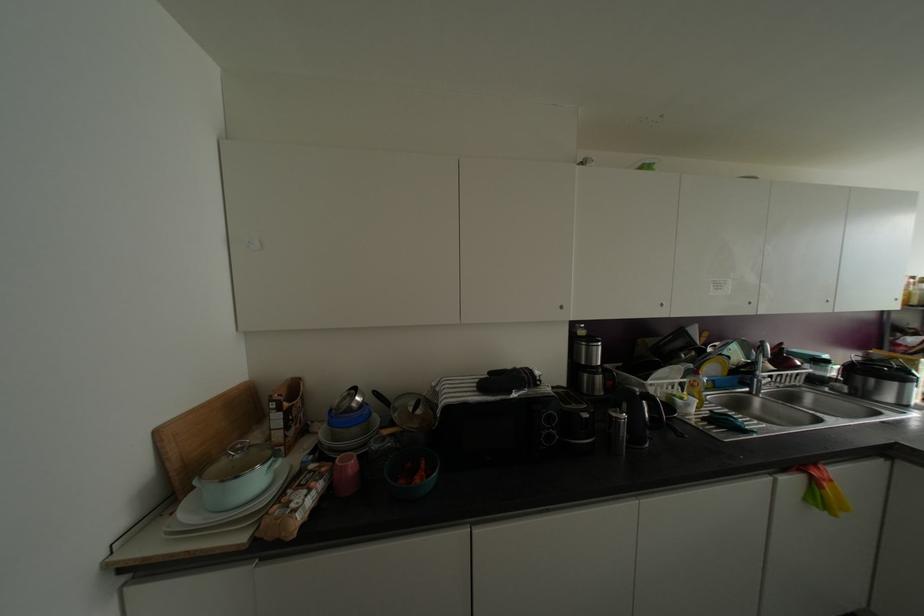
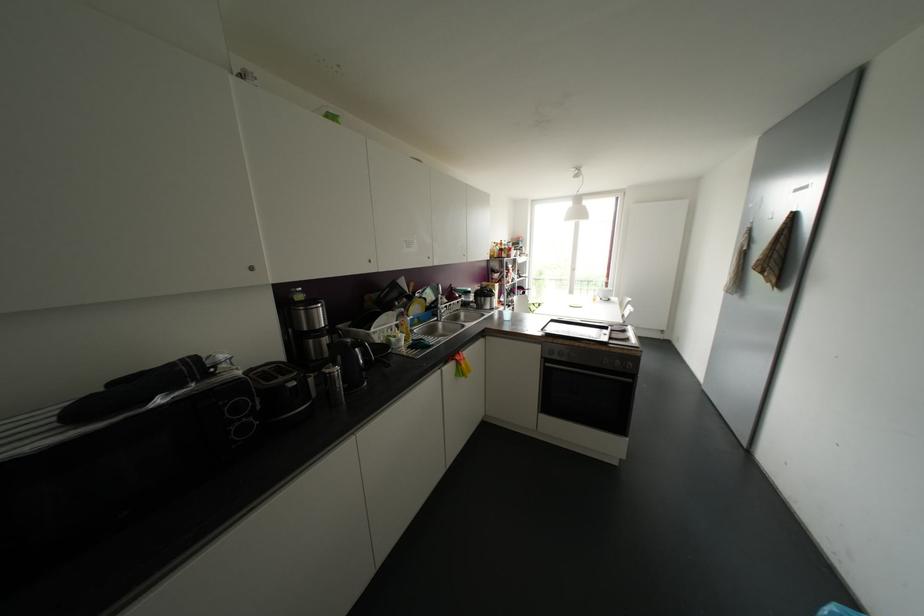
Question: The camera is either moving clockwise (left) or counter-clockwise (right) around the object. The first image is from the beginning of the video and the second image is from the end. Is the camera moving left or right when shooting the video?

Choices:
 (A) Left
 (B) Right

Answer: (A)